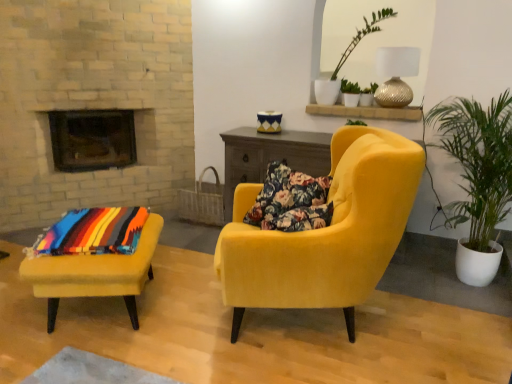
Find the location of `vacant space in velvet yellow ottoman at lower left, which is the 2th chair in right-to-left order (from a real-world perspective)`. vacant space in velvet yellow ottoman at lower left, which is the 2th chair in right-to-left order (from a real-world perspective) is located at coordinates (97, 314).